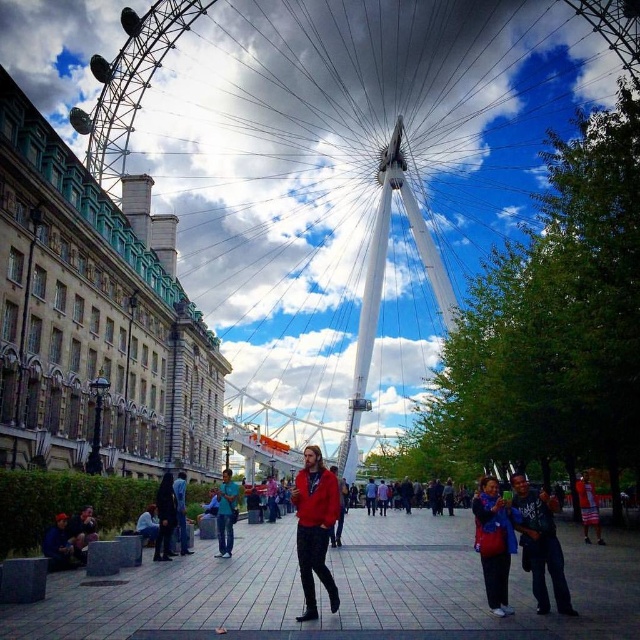
Which of these two, white metallic ferris wheel at center or blue denim jeans at center, stands taller?

white metallic ferris wheel at center

From the picture: Between white metallic ferris wheel at center and blue denim jeans at center, which one appears on the right side from the viewer's perspective?

From the viewer's perspective, white metallic ferris wheel at center appears more on the right side.

Which is in front, point (368, 339) or point (221, 483)?

Point (221, 483)

The height and width of the screenshot is (640, 640). Find the location of `white metallic ferris wheel at center`. white metallic ferris wheel at center is located at coordinates (129, 83).

The height and width of the screenshot is (640, 640). What do you see at coordinates (540, 545) in the screenshot? I see `dark blue jeans at lower right` at bounding box center [540, 545].

Between point (531, 540) and point (497, 534), which one is positioned behind?

The point (497, 534) is more distant.

Who is more distant from viewer, (538, 611) or (483, 518)?

The point (483, 518) is behind.

Locate an element on the screen. This screenshot has height=640, width=640. dark blue jeans at lower right is located at coordinates (540, 545).

Is red matte jacket at center taller than red fabric shorts at lower right?

Correct, red matte jacket at center is much taller as red fabric shorts at lower right.

Which is below, red matte jacket at center or red fabric shorts at lower right?

red fabric shorts at lower right

The height and width of the screenshot is (640, 640). What do you see at coordinates (314, 528) in the screenshot?
I see `red matte jacket at center` at bounding box center [314, 528].

I want to click on red matte jacket at center, so click(x=314, y=528).